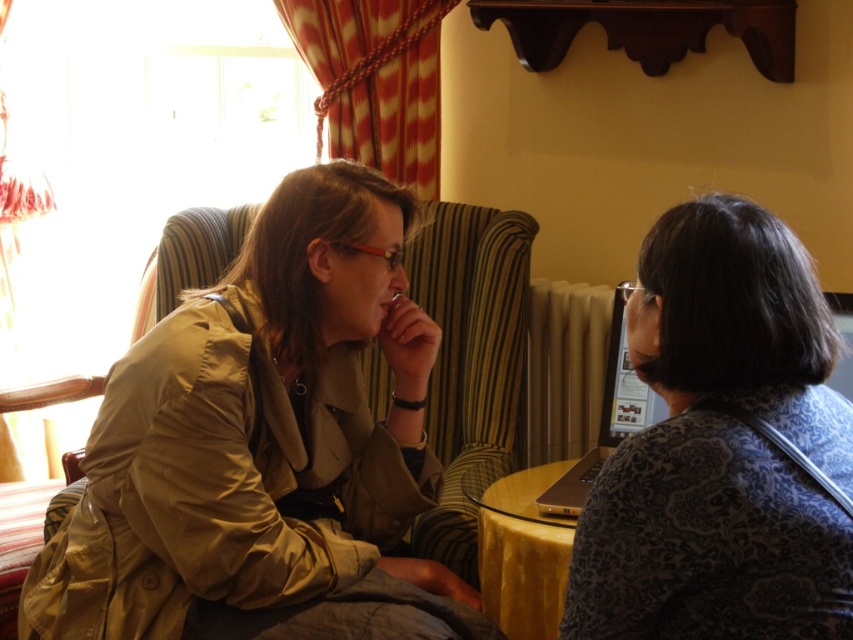
Is matte khaki trench coat at left positioned at the back of yellow glass table at center?

That is False.

Can you confirm if matte khaki trench coat at left is positioned above yellow glass table at center?

Indeed, matte khaki trench coat at left is positioned over yellow glass table at center.

Describe the element at coordinates (265, 449) in the screenshot. This screenshot has width=853, height=640. I see `matte khaki trench coat at left` at that location.

I want to click on matte khaki trench coat at left, so click(x=265, y=449).

In order to click on matte khaki trench coat at left in this screenshot , I will do 265,449.

Who is positioned more to the right, matte khaki trench coat at left or patterned fabric shirt at right?

Positioned to the right is patterned fabric shirt at right.

Identify the location of matte khaki trench coat at left. The width and height of the screenshot is (853, 640). (265, 449).

Is patterned fabric shirt at right thinner than yellow glass table at center?

Incorrect, patterned fabric shirt at right's width is not less than yellow glass table at center's.

From the picture: Can you confirm if patterned fabric shirt at right is smaller than yellow glass table at center?

No, patterned fabric shirt at right is not smaller than yellow glass table at center.

At what (x,y) coordinates should I click in order to perform the action: click on patterned fabric shirt at right. Please return your answer as a coordinate pair (x, y). Looking at the image, I should click on (721, 448).